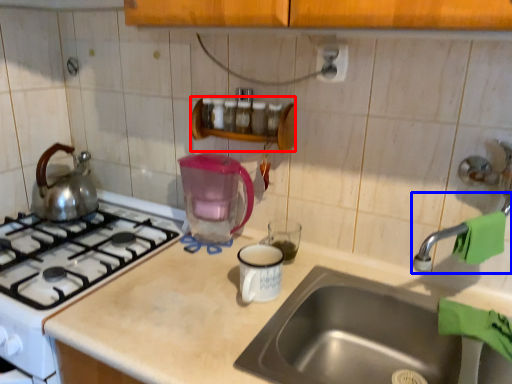
Question: Which object appears closest to the camera in this image, shelf (highlighted by a red box) or faucet (highlighted by a blue box)?

Choices:
 (A) shelf
 (B) faucet

Answer: (B)